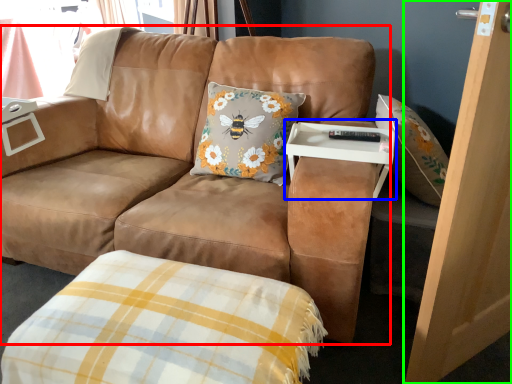
Question: Which object is positioned farthest from studio couch (highlighted by a red box)? Select from table (highlighted by a blue box) and screen door (highlighted by a green box).

Choices:
 (A) table
 (B) screen door

Answer: (B)